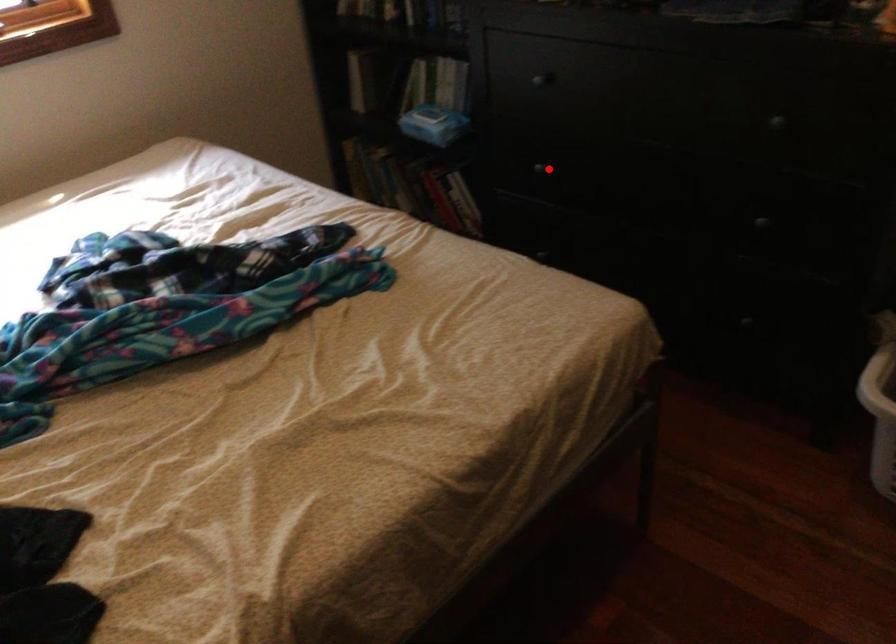
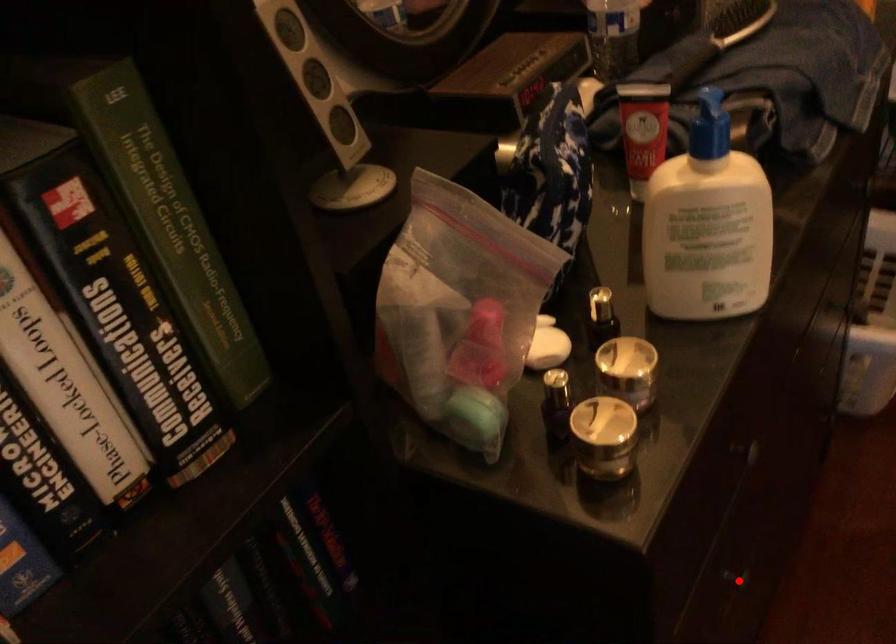
Based on the photo, I am providing you with two images of the same scene from different viewpoints. A red point is marked on the first image and another point is marked on the second image. Is the marked point in image1 the same physical position as the marked point in image2?

Yes